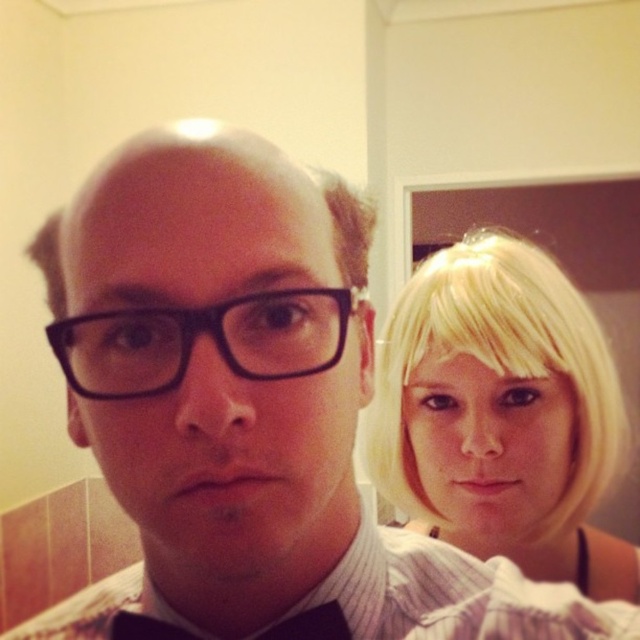
You are a photographer trying to capture a clear shot of both the blonde hair at upper right and the black plastic glasses at center. Based on their positions, which object should you focus on first to ensure both are in focus?

The blonde hair at upper right is below the black plastic glasses at center, so you should focus on the black plastic glasses at center first to ensure both are in focus.